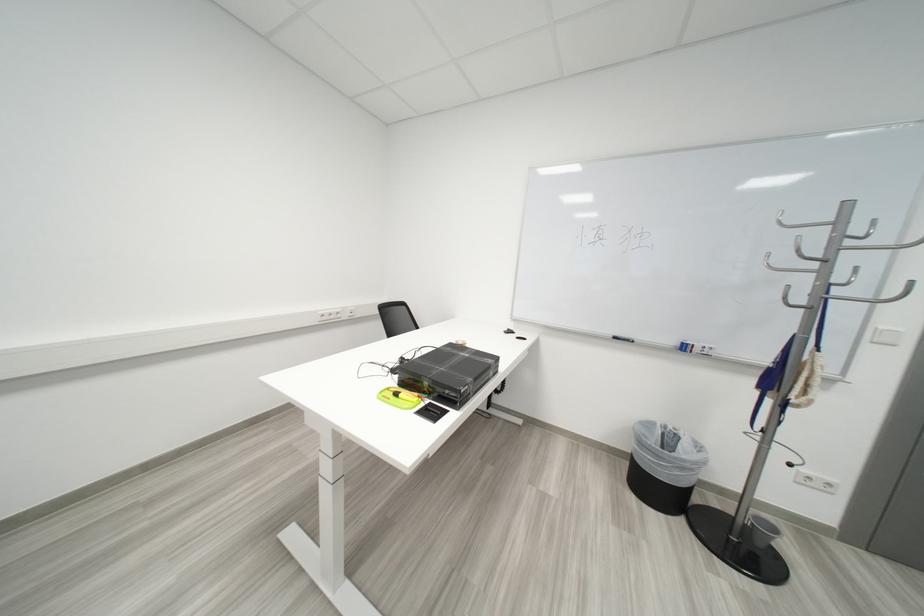
Describe the element at coordinates (885, 336) in the screenshot. This screenshot has width=924, height=616. I see `the light switch` at that location.